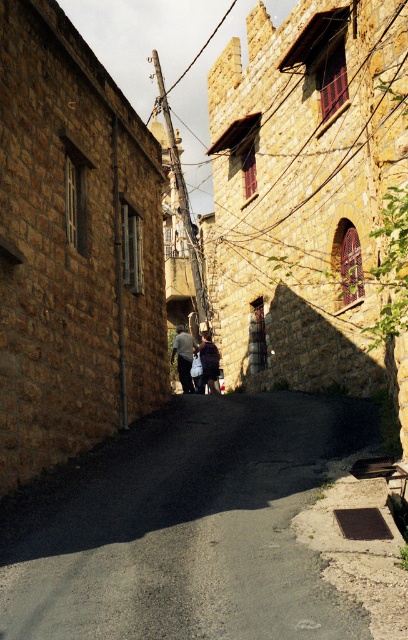
How far apart are asphalt at center and dark blue fabric at center?

asphalt at center and dark blue fabric at center are 12.80 meters apart.

Is asphalt at center shorter than dark blue fabric at center?

Yes, asphalt at center is shorter than dark blue fabric at center.

Identify the location of asphalt at center. (184, 528).

Is asphalt at center bigger than dark gray fabric at center?

Indeed, asphalt at center has a larger size compared to dark gray fabric at center.

Who is more distant from viewer, (274,522) or (177,353)?

The point (177,353) is behind.

You are a GUI agent. You are given a task and a screenshot of the screen. Output one action in this format:
    pyautogui.click(x=<x>, y=<y>)
    Task: Click on the asphalt at center
    
    Given the screenshot: What is the action you would take?
    pyautogui.click(x=184, y=528)

Identify the location of asphalt at center. (184, 528).

Can you confirm if dark gray fabric at center is positioned to the left of dark blue fabric at center?

Indeed, dark gray fabric at center is positioned on the left side of dark blue fabric at center.

Is point (186, 340) positioned after point (204, 342)?

That is False.

The height and width of the screenshot is (640, 408). I want to click on dark gray fabric at center, so click(x=184, y=356).